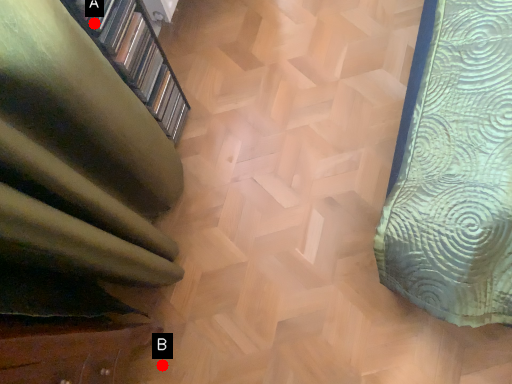
Question: Two points are circled on the image, labeled by A and B beside each circle. Among these points, which one is nearest to the camera?

Choices:
 (A) A is closer
 (B) B is closer

Answer: (A)